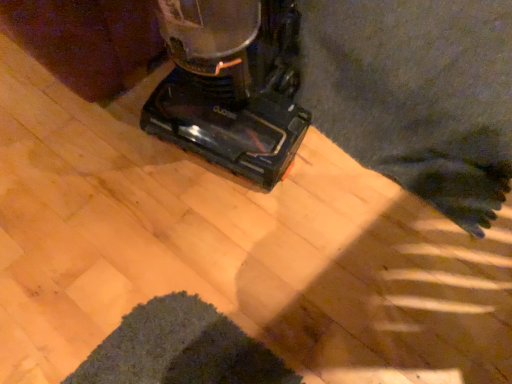
You are a GUI agent. You are given a task and a screenshot of the screen. Output one action in this format:
    pyautogui.click(x=<x>, y=<y>)
    Task: Click on the vacant space situated on the left part of black plastic vacuum cleaner at center
    The width and height of the screenshot is (512, 384).
    Given the screenshot: What is the action you would take?
    pyautogui.click(x=87, y=156)